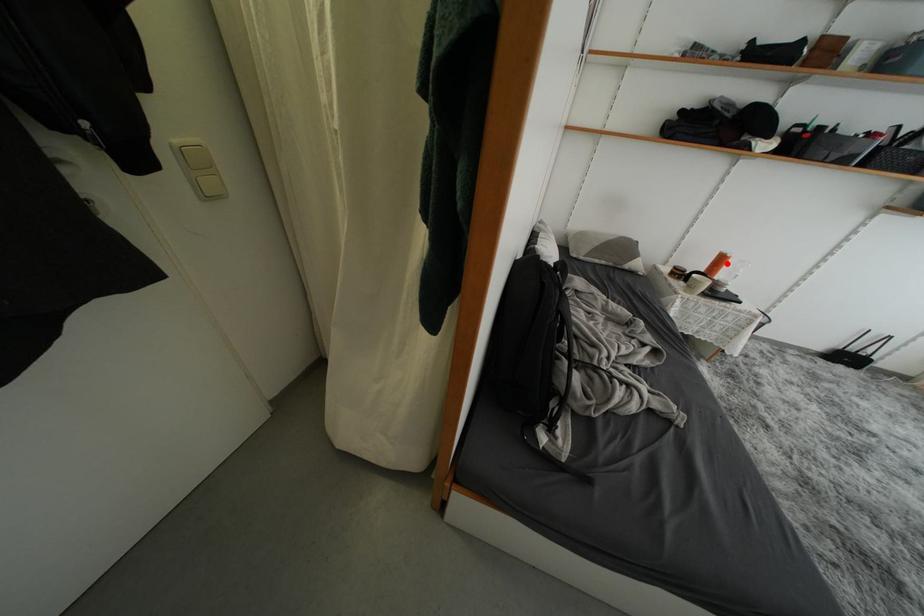
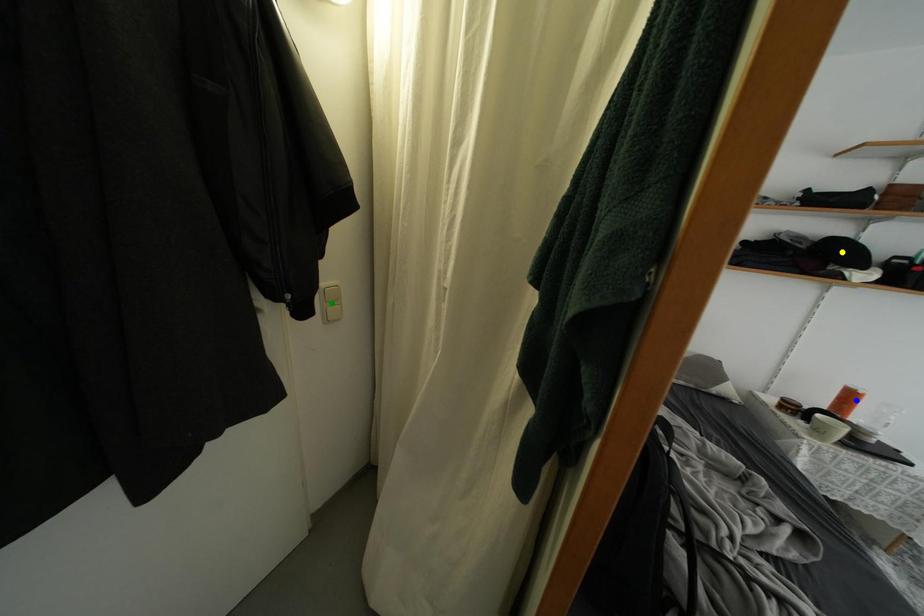
Question: I am providing you with two images of the same scene from different viewpoints. A red point is marked on the first image. You are given multiple points on the second image. Can you choose the point in image 2 that corresponds to the point in image 1?

Choices:
 (A) green point
 (B) yellow point
 (C) blue point

Answer: (C)